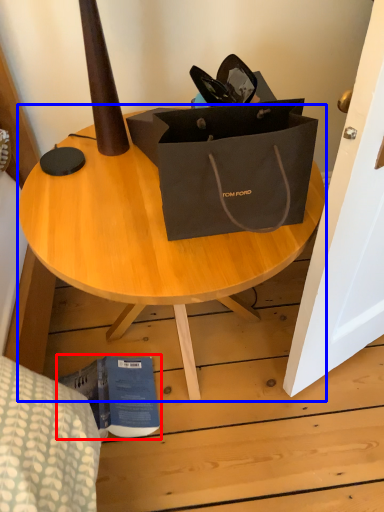
Question: Which point is further to the camera, book (highlighted by a red box) or coffee table (highlighted by a blue box)?

Choices:
 (A) book
 (B) coffee table

Answer: (A)